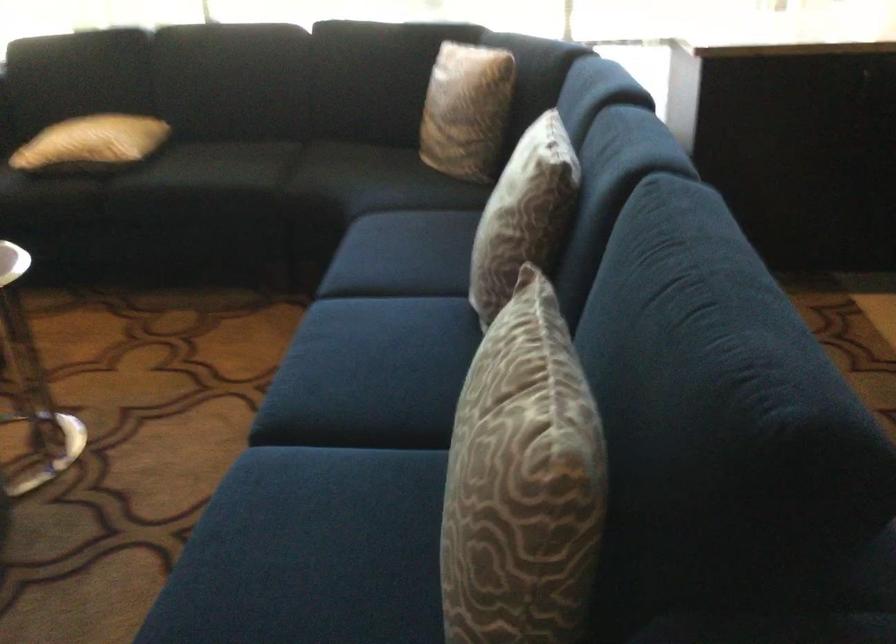
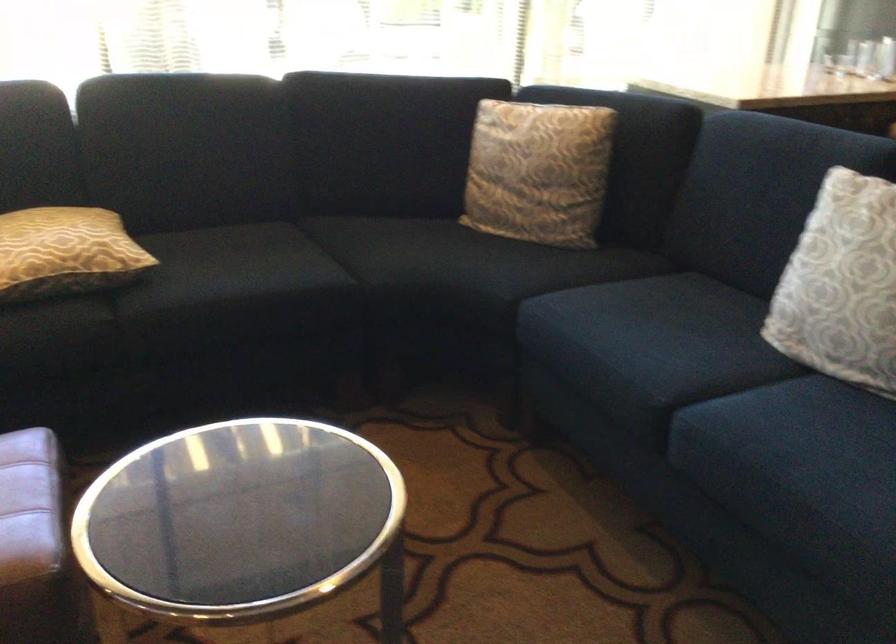
Where in the second image is the point corresponding to (454,108) from the first image?

(538, 172)